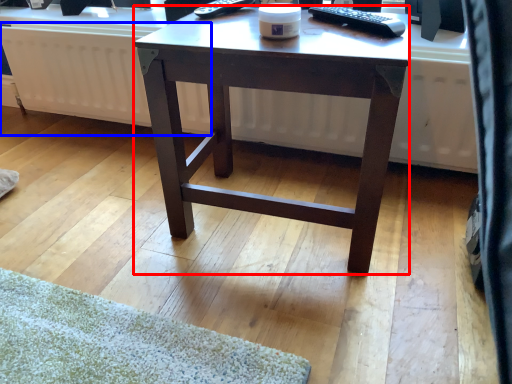
Question: Which of the following is the closest to the observer, desk (highlighted by a red box) or radiator (highlighted by a blue box)?

Choices:
 (A) desk
 (B) radiator

Answer: (A)